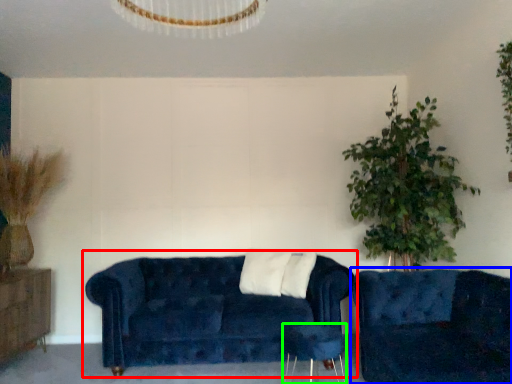
Question: Which is farther away from studio couch (highlighted by a red box)? studio couch (highlighted by a blue box) or side table (highlighted by a green box)?

Choices:
 (A) studio couch
 (B) side table

Answer: (A)